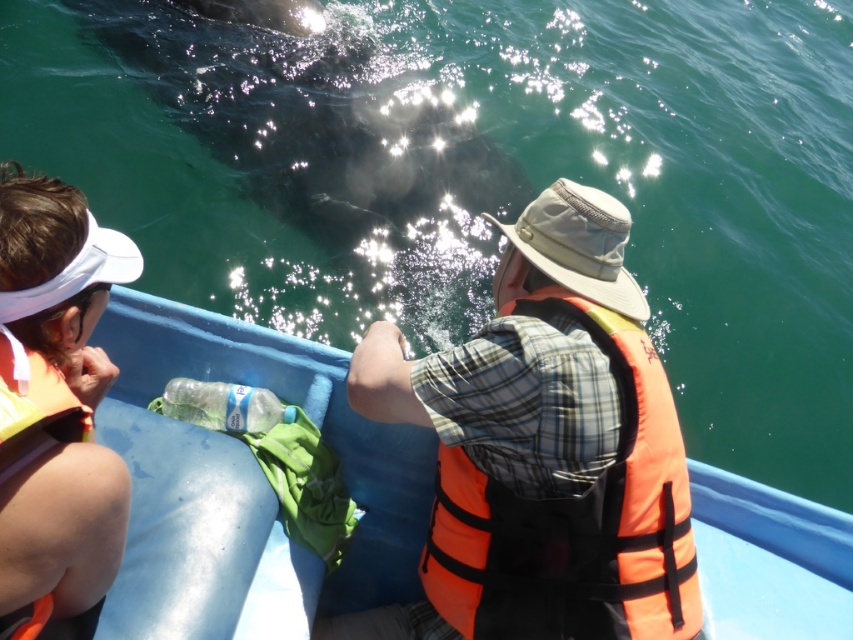
Does dark gray skin at upper center have a larger size compared to orange life jacket at left?

Yes.

Which of these two, dark gray skin at upper center or orange life jacket at left, stands taller?

With more height is dark gray skin at upper center.

What do you see at coordinates (311, 116) in the screenshot? Image resolution: width=853 pixels, height=640 pixels. I see `dark gray skin at upper center` at bounding box center [311, 116].

Locate an element on the screen. The height and width of the screenshot is (640, 853). dark gray skin at upper center is located at coordinates (311, 116).

Can you confirm if dark gray skin at upper center is positioned to the left of orange life vest at left?

Yes, dark gray skin at upper center is to the left of orange life vest at left.

Can you confirm if dark gray skin at upper center is positioned above orange life vest at left?

Yes.

Is point (318, 202) positioned after point (41, 252)?

Yes.

Where is `dark gray skin at upper center`? dark gray skin at upper center is located at coordinates (311, 116).

Is blue plastic boat at center above orange life vest at left?

Incorrect, blue plastic boat at center is not positioned above orange life vest at left.

Where is `blue plastic boat at center`? blue plastic boat at center is located at coordinates (244, 484).

Between point (287, 388) and point (50, 268), which one is positioned behind?

The point (287, 388) is more distant.

Where is `blue plastic boat at center`? The height and width of the screenshot is (640, 853). blue plastic boat at center is located at coordinates (244, 484).